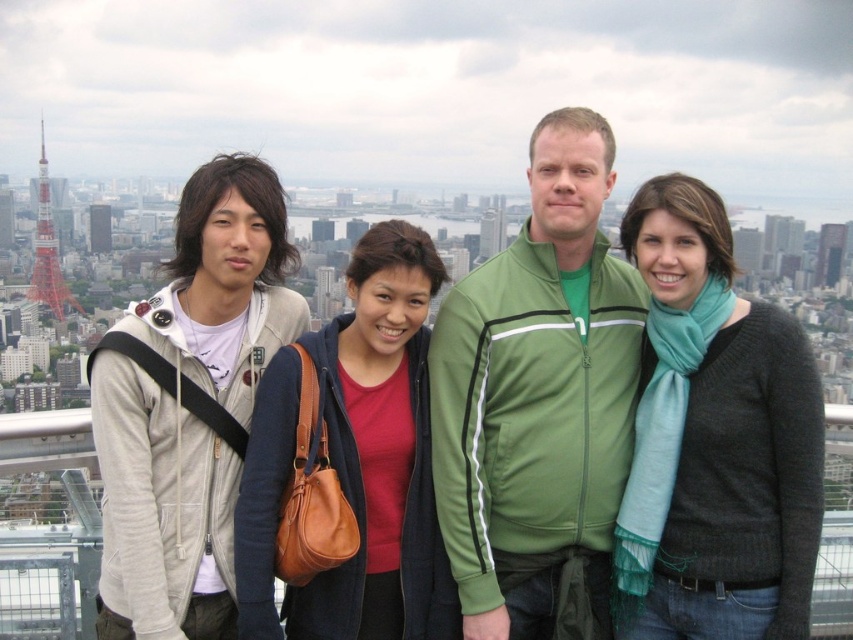
Please provide the 2D coordinates of the matte gray hoodie at left in the image.

The matte gray hoodie at left is located at the 2D coordinates of point (709, 442).

You are a photographer trying to capture a wide shot of the matte gray hoodie at left and the red painted metal tower at upper left. Which object should you focus on first to ensure both are in frame?

The matte gray hoodie at left is wider than the red painted metal tower at upper left, so focus on the matte gray hoodie at left first to ensure both fit in the frame.